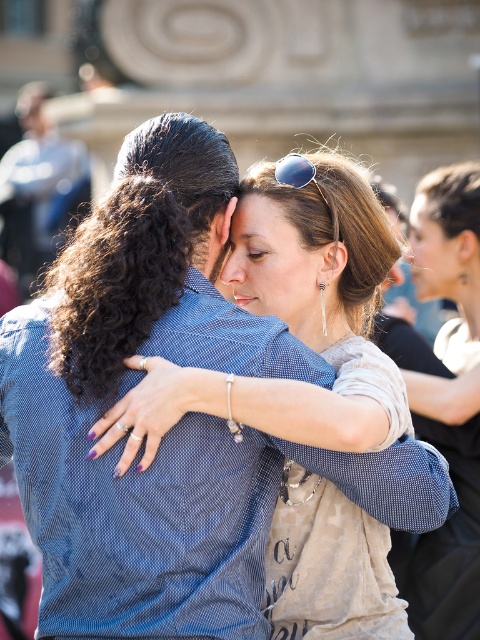
Question: Which point appears closest to the camera in this image?

Choices:
 (A) (298, 164)
 (B) (463, 620)
 (C) (320, 152)

Answer: (A)

Question: Does matte blue shirt at center have a larger size compared to light beige fabric purse at center?

Choices:
 (A) yes
 (B) no

Answer: (A)

Question: Which object is the farthest from the matte blue shirt at center?

Choices:
 (A) sunglasses at center
 (B) light beige fabric purse at center

Answer: (B)

Question: Estimate the real-world distances between objects in this image. Which object is farther from the matte blue shirt at center?

Choices:
 (A) light beige fabric purse at center
 (B) sunglasses at center

Answer: (A)

Question: Is the position of matte blue shirt at center less distant than that of light beige fabric purse at center?

Choices:
 (A) no
 (B) yes

Answer: (B)

Question: Where is matte blue shirt at center located in relation to light beige fabric purse at center in the image?

Choices:
 (A) below
 (B) above

Answer: (B)